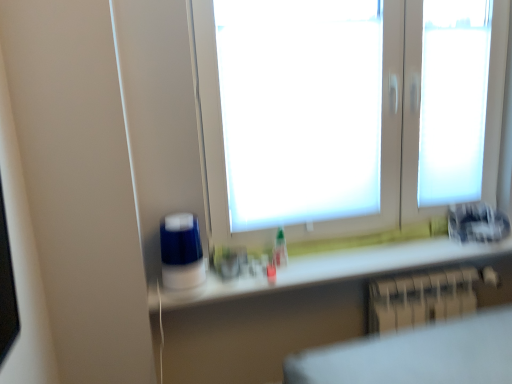
Question: Could white matte window at center be considered to be inside white glossy counter top at lower center?

Choices:
 (A) no
 (B) yes

Answer: (A)

Question: Considering the relative sizes of white glossy counter top at lower center and white matte window at center in the image provided, is white glossy counter top at lower center shorter than white matte window at center?

Choices:
 (A) yes
 (B) no

Answer: (A)

Question: Is white glossy counter top at lower center wider than white matte window at center?

Choices:
 (A) yes
 (B) no

Answer: (A)

Question: From the image's perspective, would you say white glossy counter top at lower center is shown under white matte window at center?

Choices:
 (A) yes
 (B) no

Answer: (A)

Question: Could you tell me if white glossy counter top at lower center is turned towards white matte window at center?

Choices:
 (A) no
 (B) yes

Answer: (A)

Question: In terms of height, does metallic silver radiator at lower right look taller or shorter compared to white glossy counter top at lower center?

Choices:
 (A) tall
 (B) short

Answer: (A)

Question: Is metallic silver radiator at lower right wider or thinner than white glossy counter top at lower center?

Choices:
 (A) wide
 (B) thin

Answer: (B)

Question: Relative to white glossy counter top at lower center, is metallic silver radiator at lower right in front or behind?

Choices:
 (A) front
 (B) behind

Answer: (B)

Question: Does point (435, 299) appear closer or farther from the camera than point (475, 259)?

Choices:
 (A) closer
 (B) farther

Answer: (A)

Question: Considering the positions of white matte window at center and white glossy counter top at lower center in the image, is white matte window at center wider or thinner than white glossy counter top at lower center?

Choices:
 (A) wide
 (B) thin

Answer: (B)

Question: Looking at the image, does white matte window at center seem bigger or smaller compared to white glossy counter top at lower center?

Choices:
 (A) big
 (B) small

Answer: (A)

Question: In the image, is white matte window at center positioned in front of or behind white glossy counter top at lower center?

Choices:
 (A) behind
 (B) front

Answer: (B)

Question: Considering the positions of point (392, 23) and point (450, 281), is point (392, 23) closer or farther from the camera than point (450, 281)?

Choices:
 (A) closer
 (B) farther

Answer: (A)

Question: Is point (230, 291) positioned closer to the camera than point (465, 148)?

Choices:
 (A) farther
 (B) closer

Answer: (B)

Question: From a real-world perspective, relative to white matte window at center, is white glossy counter top at lower center vertically above or below?

Choices:
 (A) above
 (B) below

Answer: (B)